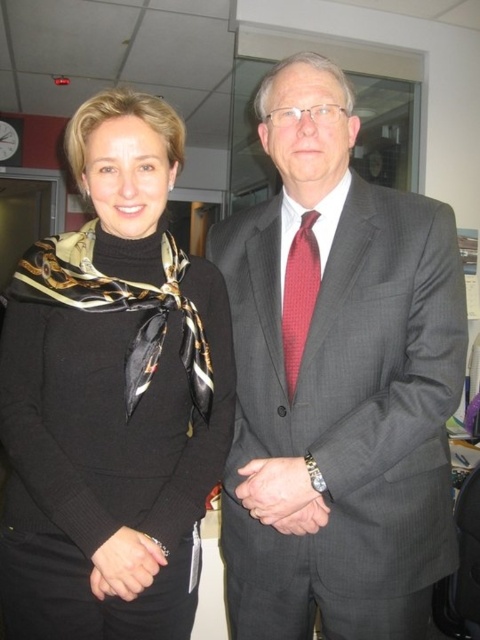
Who is more forward, (15,513) or (283,340)?

Result: Point (15,513) is in front.

Who is more forward, (96,506) or (312,236)?

Point (96,506) is more forward.

The width and height of the screenshot is (480, 640). I want to click on black silk scarf at left, so click(111, 396).

In the scene shown: Does matte gray suit at center appear on the left side of red textured tie at center?

Incorrect, matte gray suit at center is not on the left side of red textured tie at center.

Who is more forward, (370, 477) or (305, 321)?

Point (370, 477) is more forward.

Between point (300, 385) and point (285, 326), which one is positioned behind?

Positioned behind is point (285, 326).

At what (x,y) coordinates should I click in order to perform the action: click on matte gray suit at center. Please return your answer as a coordinate pair (x, y). Image resolution: width=480 pixels, height=640 pixels. Looking at the image, I should click on (336, 381).

Is matte gray suit at center shorter than black silk scarf at left?

No.

Which is above, matte gray suit at center or black silk scarf at left?

Positioned higher is black silk scarf at left.

What do you see at coordinates (336, 381) in the screenshot? I see `matte gray suit at center` at bounding box center [336, 381].

At what (x,y) coordinates should I click in order to perform the action: click on matte gray suit at center. Please return your answer as a coordinate pair (x, y). The height and width of the screenshot is (640, 480). Looking at the image, I should click on (336, 381).